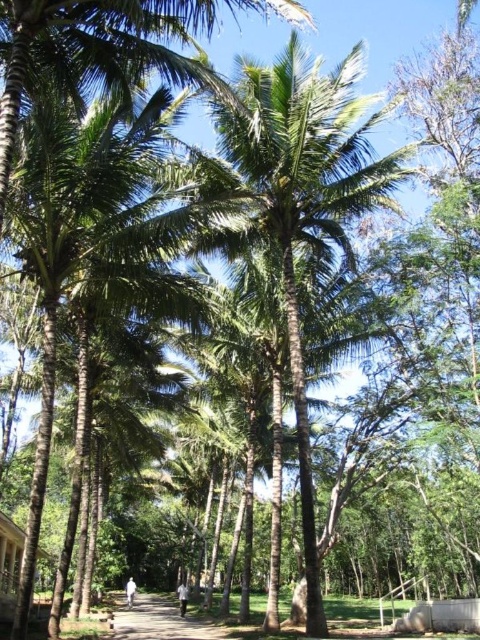
Is green leafy coconut tree at center below brown dirt path at center?

Incorrect, green leafy coconut tree at center is not positioned below brown dirt path at center.

Is green leafy coconut tree at center to the left of brown dirt path at center from the viewer's perspective?

In fact, green leafy coconut tree at center is to the right of brown dirt path at center.

Which is behind, point (307, 436) or point (144, 618)?

Point (144, 618)

The width and height of the screenshot is (480, 640). I want to click on green leafy coconut tree at center, so click(x=295, y=202).

Can you confirm if green leafy coconut tree at center is positioned below wooden hut at lower left?

Incorrect, green leafy coconut tree at center is not positioned below wooden hut at lower left.

Between green leafy coconut tree at center and wooden hut at lower left, which one has less height?

wooden hut at lower left

Between point (362, 198) and point (4, 588), which one is positioned behind?

Positioned behind is point (4, 588).

This screenshot has width=480, height=640. Identify the location of green leafy coconut tree at center. (x=295, y=202).

Which is behind, point (165, 598) or point (2, 531)?

Positioned behind is point (165, 598).

Does brown dirt path at center appear under wooden hut at lower left?

Yes, brown dirt path at center is below wooden hut at lower left.

Which is in front, point (201, 620) or point (4, 602)?

Positioned in front is point (4, 602).

The height and width of the screenshot is (640, 480). I want to click on brown dirt path at center, so click(x=158, y=620).